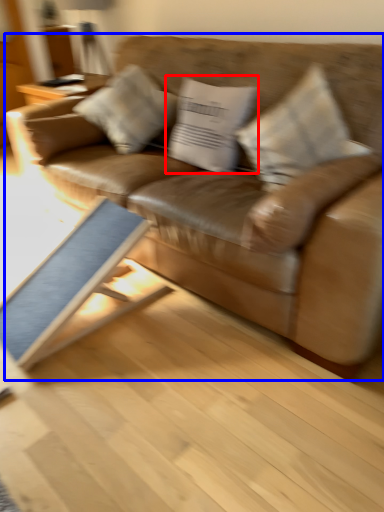
Question: Which of the following is the closest to the observer, pillow (highlighted by a red box) or studio couch (highlighted by a blue box)?

Choices:
 (A) pillow
 (B) studio couch

Answer: (B)